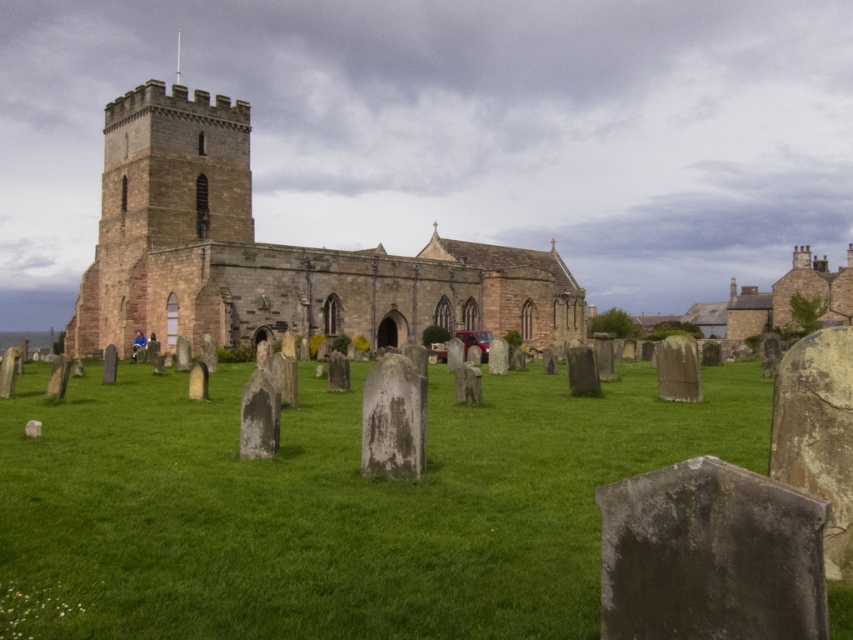
Who is lower down, brown stone church at center or blue fabric jacket at center?

blue fabric jacket at center

How much distance is there between brown stone church at center and blue fabric jacket at center?

A distance of 115.86 feet exists between brown stone church at center and blue fabric jacket at center.

Consider the image. Measure the distance between brown stone church at center and camera.

79.97 meters

Locate an element on the screen. This screenshot has width=853, height=640. brown stone church at center is located at coordinates (273, 252).

Is point (602, 477) behind point (469, 326)?

No, (602, 477) is closer to viewer.

Who is positioned more to the right, green grassy at center or brown stone church at center?

Positioned to the right is brown stone church at center.

Where is `green grassy at center`? This screenshot has height=640, width=853. green grassy at center is located at coordinates (335, 502).

Locate an element on the screen. This screenshot has height=640, width=853. green grassy at center is located at coordinates (335, 502).

Does green grassy at center lie behind blue fabric jacket at center?

No, green grassy at center is closer to the viewer.

Does green grassy at center have a greater width compared to blue fabric jacket at center?

Indeed, green grassy at center has a greater width compared to blue fabric jacket at center.

Locate an element on the screen. The image size is (853, 640). green grassy at center is located at coordinates coord(335,502).